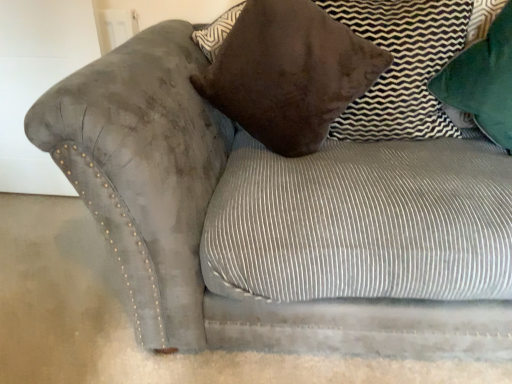
The height and width of the screenshot is (384, 512). What do you see at coordinates (483, 81) in the screenshot?
I see `green velvet pillow at upper right, arranged as the first pillow when viewed from the right` at bounding box center [483, 81].

Where is `velvet brown pillow at upper center, marked as the first pillow in a left-to-right arrangement`? The height and width of the screenshot is (384, 512). velvet brown pillow at upper center, marked as the first pillow in a left-to-right arrangement is located at coordinates (289, 73).

Which object is further away from the camera taking this photo, green velvet pillow at upper right, arranged as the first pillow when viewed from the right, or velvet brown pillow at upper center, marked as the first pillow in a left-to-right arrangement?

green velvet pillow at upper right, arranged as the first pillow when viewed from the right, is behind.

Is green velvet pillow at upper right, which ranks as the 3th pillow in left-to-right order, to the left or to the right of velvet brown pillow at upper center, which is counted as the 3th pillow, starting from the right, in the image?

Clearly, green velvet pillow at upper right, which ranks as the 3th pillow in left-to-right order, is on the right of velvet brown pillow at upper center, which is counted as the 3th pillow, starting from the right, in the image.

From the image's perspective, which one is positioned lower, green velvet pillow at upper right, which ranks as the 3th pillow in left-to-right order, or velvet brown pillow at upper center, marked as the first pillow in a left-to-right arrangement?

velvet brown pillow at upper center, marked as the first pillow in a left-to-right arrangement.

Is velvet brown pillow at upper center, marked as the first pillow in a left-to-right arrangement, completely or partially inside green velvet pillow at upper right, arranged as the first pillow when viewed from the right?

No.

From a real-world perspective, between brown suede pillow at upper right, which is counted as the 2th pillow, starting from the left, and velvet brown pillow at upper center, marked as the first pillow in a left-to-right arrangement, who is vertically higher?

brown suede pillow at upper right, which is counted as the 2th pillow, starting from the left, from a real-world perspective.

Locate an element on the screen. Image resolution: width=512 pixels, height=384 pixels. pillow that is the 1st one when counting rightward from the velvet brown pillow at upper center, which is counted as the 3th pillow, starting from the right is located at coordinates (402, 66).

In terms of height, does brown suede pillow at upper right, acting as the 2th pillow starting from the right, look taller or shorter compared to velvet brown pillow at upper center, marked as the first pillow in a left-to-right arrangement?

Clearly, brown suede pillow at upper right, acting as the 2th pillow starting from the right, is shorter compared to velvet brown pillow at upper center, marked as the first pillow in a left-to-right arrangement.

Is velvet brown pillow at upper center, marked as the first pillow in a left-to-right arrangement, next to brown suede pillow at upper right, acting as the 2th pillow starting from the right?

No, velvet brown pillow at upper center, marked as the first pillow in a left-to-right arrangement, is not with brown suede pillow at upper right, acting as the 2th pillow starting from the right.

Is point (332, 97) closer to viewer compared to point (377, 80)?

Yes, it is in front of point (377, 80).

Considering the relative sizes of velvet brown pillow at upper center, which is counted as the 3th pillow, starting from the right, and brown suede pillow at upper right, acting as the 2th pillow starting from the right, in the image provided, is velvet brown pillow at upper center, which is counted as the 3th pillow, starting from the right, thinner than brown suede pillow at upper right, acting as the 2th pillow starting from the right,?

No, velvet brown pillow at upper center, which is counted as the 3th pillow, starting from the right, is not thinner than brown suede pillow at upper right, acting as the 2th pillow starting from the right.

Between velvet brown pillow at upper center, marked as the first pillow in a left-to-right arrangement, and brown suede pillow at upper right, which is counted as the 2th pillow, starting from the left, which one appears on the left side from the viewer's perspective?

From the viewer's perspective, velvet brown pillow at upper center, marked as the first pillow in a left-to-right arrangement, appears more on the left side.

From a real-world perspective, is green velvet pillow at upper right, which ranks as the 3th pillow in left-to-right order, above or below brown suede pillow at upper right, acting as the 2th pillow starting from the right?

green velvet pillow at upper right, which ranks as the 3th pillow in left-to-right order, is above brown suede pillow at upper right, acting as the 2th pillow starting from the right.

Choose the correct answer: Is green velvet pillow at upper right, which ranks as the 3th pillow in left-to-right order, inside brown suede pillow at upper right, acting as the 2th pillow starting from the right, or outside it?

green velvet pillow at upper right, which ranks as the 3th pillow in left-to-right order, is outside brown suede pillow at upper right, acting as the 2th pillow starting from the right.

Does point (504, 44) come farther from viewer compared to point (339, 21)?

No.

From the image's perspective, which one is positioned lower, green velvet pillow at upper right, which ranks as the 3th pillow in left-to-right order, or brown suede pillow at upper right, which is counted as the 2th pillow, starting from the left?

green velvet pillow at upper right, which ranks as the 3th pillow in left-to-right order, from the image's perspective.

How distant is velvet brown pillow at upper center, marked as the first pillow in a left-to-right arrangement, from green velvet pillow at upper right, arranged as the first pillow when viewed from the right?

15.34 inches.

From the velvet brown pillow at upper center, which is counted as the 3th pillow, starting from the right, count 2nd pillow to the right and point to it. Please provide its 2D coordinates.

[(483, 81)]

Is green velvet pillow at upper right, arranged as the first pillow when viewed from the right, inside velvet brown pillow at upper center, which is counted as the 3th pillow, starting from the right?

No, green velvet pillow at upper right, arranged as the first pillow when viewed from the right, is located outside of velvet brown pillow at upper center, which is counted as the 3th pillow, starting from the right.

Which object is more forward, velvet brown pillow at upper center, marked as the first pillow in a left-to-right arrangement, or green velvet pillow at upper right, arranged as the first pillow when viewed from the right?

velvet brown pillow at upper center, marked as the first pillow in a left-to-right arrangement.

Is brown suede pillow at upper right, acting as the 2th pillow starting from the right, not near green velvet pillow at upper right, which ranks as the 3th pillow in left-to-right order?

No.

From the picture: Measure the distance from brown suede pillow at upper right, which is counted as the 2th pillow, starting from the left, to green velvet pillow at upper right, arranged as the first pillow when viewed from the right.

brown suede pillow at upper right, which is counted as the 2th pillow, starting from the left, and green velvet pillow at upper right, arranged as the first pillow when viewed from the right, are 5.17 inches apart from each other.

Is brown suede pillow at upper right, acting as the 2th pillow starting from the right, wider or thinner than green velvet pillow at upper right, arranged as the first pillow when viewed from the right?

Clearly, brown suede pillow at upper right, acting as the 2th pillow starting from the right, has less width compared to green velvet pillow at upper right, arranged as the first pillow when viewed from the right.

Is brown suede pillow at upper right, acting as the 2th pillow starting from the right, positioned with its back to green velvet pillow at upper right, which ranks as the 3th pillow in left-to-right order?

No, brown suede pillow at upper right, acting as the 2th pillow starting from the right,'s orientation is not away from green velvet pillow at upper right, which ranks as the 3th pillow in left-to-right order.

Where is `pillow in front of the green velvet pillow at upper right, arranged as the first pillow when viewed from the right`? pillow in front of the green velvet pillow at upper right, arranged as the first pillow when viewed from the right is located at coordinates (289, 73).

Find the location of a particular element. The height and width of the screenshot is (384, 512). pillow located underneath the brown suede pillow at upper right, which is counted as the 2th pillow, starting from the left (from a real-world perspective) is located at coordinates [289, 73].

Which object lies further to the anchor point velvet brown pillow at upper center, marked as the first pillow in a left-to-right arrangement, brown suede pillow at upper right, acting as the 2th pillow starting from the right, or green velvet pillow at upper right, arranged as the first pillow when viewed from the right?

Based on the image, green velvet pillow at upper right, arranged as the first pillow when viewed from the right, appears to be further to velvet brown pillow at upper center, marked as the first pillow in a left-to-right arrangement.

When comparing their distances from brown suede pillow at upper right, which is counted as the 2th pillow, starting from the left, does green velvet pillow at upper right, arranged as the first pillow when viewed from the right, or velvet brown pillow at upper center, marked as the first pillow in a left-to-right arrangement, seem closer?

Among the two, green velvet pillow at upper right, arranged as the first pillow when viewed from the right, is located nearer to brown suede pillow at upper right, which is counted as the 2th pillow, starting from the left.

Considering their positions, is brown suede pillow at upper right, which is counted as the 2th pillow, starting from the left, positioned closer to green velvet pillow at upper right, arranged as the first pillow when viewed from the right, than velvet brown pillow at upper center, marked as the first pillow in a left-to-right arrangement?

brown suede pillow at upper right, which is counted as the 2th pillow, starting from the left, is positioned closer to the anchor green velvet pillow at upper right, arranged as the first pillow when viewed from the right.

Looking at the image, which one is located further to velvet brown pillow at upper center, which is counted as the 3th pillow, starting from the right, green velvet pillow at upper right, which ranks as the 3th pillow in left-to-right order, or brown suede pillow at upper right, which is counted as the 2th pillow, starting from the left?

Based on the image, green velvet pillow at upper right, which ranks as the 3th pillow in left-to-right order, appears to be further to velvet brown pillow at upper center, which is counted as the 3th pillow, starting from the right.

Estimate the real-world distances between objects in this image. Which object is closer to green velvet pillow at upper right, which ranks as the 3th pillow in left-to-right order, velvet brown pillow at upper center, which is counted as the 3th pillow, starting from the right, or brown suede pillow at upper right, acting as the 2th pillow starting from the right?

The object closer to green velvet pillow at upper right, which ranks as the 3th pillow in left-to-right order, is brown suede pillow at upper right, acting as the 2th pillow starting from the right.

Considering their positions, is velvet brown pillow at upper center, marked as the first pillow in a left-to-right arrangement, positioned further to brown suede pillow at upper right, acting as the 2th pillow starting from the right, than green velvet pillow at upper right, arranged as the first pillow when viewed from the right?

Among the two, velvet brown pillow at upper center, marked as the first pillow in a left-to-right arrangement, is located further to brown suede pillow at upper right, acting as the 2th pillow starting from the right.

Locate an element on the screen. pillow between velvet brown pillow at upper center, which is counted as the 3th pillow, starting from the right, and green velvet pillow at upper right, which ranks as the 3th pillow in left-to-right order, in the horizontal direction is located at coordinates (402, 66).